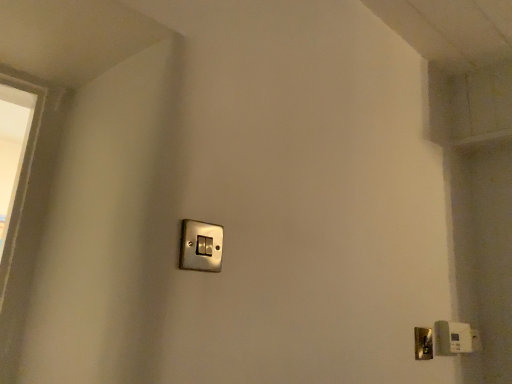
Question: Should I look upward or downward to see metallic silver light switch at center, the second light switch positioned from the bottom?

Choices:
 (A) up
 (B) down

Answer: (B)

Question: Considering the relative sizes of metallic silver light switch at center, which appears as the second light switch when viewed from the right, and satin silver light switch at lower right, the 2th light switch positioned from the left, in the image provided, is metallic silver light switch at center, which appears as the second light switch when viewed from the right, wider than satin silver light switch at lower right, the 2th light switch positioned from the left,?

Choices:
 (A) no
 (B) yes

Answer: (A)

Question: Can you confirm if metallic silver light switch at center, the second light switch positioned from the bottom, is smaller than satin silver light switch at lower right, which is the first light switch from right to left?

Choices:
 (A) no
 (B) yes

Answer: (B)

Question: Is satin silver light switch at lower right, the first light switch when ordered from bottom to top, surrounded by metallic silver light switch at center, the second light switch positioned from the bottom?

Choices:
 (A) no
 (B) yes

Answer: (A)

Question: From a real-world perspective, is metallic silver light switch at center, acting as the 1th light switch starting from the top, on satin silver light switch at lower right, which is the first light switch from right to left?

Choices:
 (A) yes
 (B) no

Answer: (A)

Question: Could you tell me if metallic silver light switch at center, acting as the first light switch starting from the front, is turned towards satin silver light switch at lower right, arranged as the second light switch when viewed from the top?

Choices:
 (A) no
 (B) yes

Answer: (A)

Question: Is satin silver light switch at lower right, the first light switch when ordered from bottom to top, at the back of metallic silver light switch at center, placed as the second light switch when sorted from back to front?

Choices:
 (A) yes
 (B) no

Answer: (B)

Question: From the image's perspective, is metallic silver light switch at center, which appears as the second light switch when viewed from the right, beneath polished brass door handle at lower right?

Choices:
 (A) no
 (B) yes

Answer: (A)

Question: From a real-world perspective, is metallic silver light switch at center, the first light switch viewed from the left, positioned over polished brass door handle at lower right based on gravity?

Choices:
 (A) no
 (B) yes

Answer: (B)

Question: Is metallic silver light switch at center, which appears as the second light switch when viewed from the right, next to polished brass door handle at lower right?

Choices:
 (A) yes
 (B) no

Answer: (B)

Question: Can you confirm if metallic silver light switch at center, the second light switch positioned from the bottom, is positioned to the right of polished brass door handle at lower right?

Choices:
 (A) yes
 (B) no

Answer: (B)

Question: Is metallic silver light switch at center, which appears as the second light switch when viewed from the right, at the left side of polished brass door handle at lower right?

Choices:
 (A) yes
 (B) no

Answer: (A)

Question: Is metallic silver light switch at center, which appears as the second light switch when viewed from the right, taller than polished brass door handle at lower right?

Choices:
 (A) no
 (B) yes

Answer: (A)

Question: Is satin silver light switch at lower right, the first light switch when ordered from bottom to top, beside metallic silver light switch at center, acting as the 1th light switch starting from the top?

Choices:
 (A) yes
 (B) no

Answer: (B)